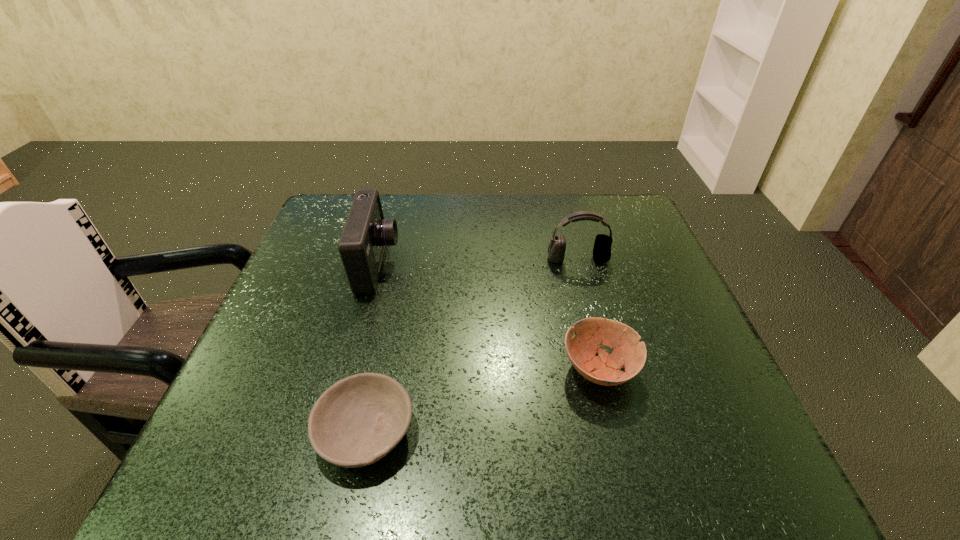
Where is `free spot at the far right corner of the desktop`? This screenshot has width=960, height=540. free spot at the far right corner of the desktop is located at coordinates (606, 234).

Identify the location of vacant region between the left bowl and the camera. The image size is (960, 540). (372, 348).

At what (x,y) coordinates should I click in order to perform the action: click on vacant space in between the camera and the shortest object. Please return your answer as a coordinate pair (x, y). The width and height of the screenshot is (960, 540). Looking at the image, I should click on (372, 348).

Locate an element on the screen. empty space that is in between the headset and the right bowl is located at coordinates (588, 314).

Where is `free point between the headset and the right bowl`? This screenshot has width=960, height=540. free point between the headset and the right bowl is located at coordinates (588, 314).

At what (x,y) coordinates should I click in order to perform the action: click on free spot between the camera and the third tallest object. Please return your answer as a coordinate pair (x, y). This screenshot has height=540, width=960. Looking at the image, I should click on (489, 317).

Locate an element on the screen. unoccupied position between the camera and the third tallest object is located at coordinates (489, 317).

Identify the location of vacant area that lies between the second shortest object and the headset. (588, 314).

I want to click on free point between the shorter bowl and the right bowl, so click(x=483, y=400).

What are the coordinates of `unoccupied area between the camera and the shortest object` in the screenshot? It's located at (372, 348).